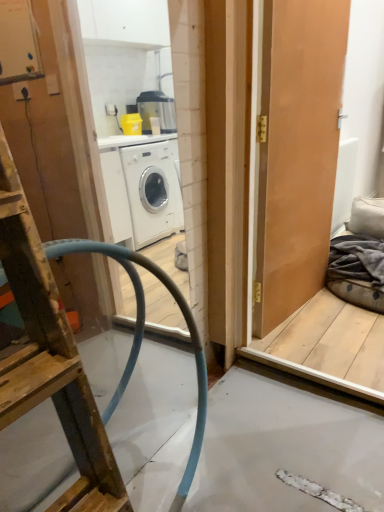
At what (x,y) coordinates should I click in order to perform the action: click on wooden ladder at left. Please return your answer as a coordinate pair (x, y). Image resolution: width=384 pixels, height=512 pixels. Looking at the image, I should click on (50, 357).

Which object is positioned more to the right, matte wooden door at right or dark grey fabric at right?

dark grey fabric at right is more to the right.

Are matte wooden door at right and dark grey fabric at right located far from each other?

No, matte wooden door at right is in close proximity to dark grey fabric at right.

In the scene shown: Does matte wooden door at right contain dark grey fabric at right?

Actually, dark grey fabric at right is outside matte wooden door at right.

How many degrees apart are the facing directions of matte wooden door at right and dark grey fabric at right?

They differ by 78.9 degrees in their facing directions.

Is point (91, 494) positioned after point (323, 39)?

No, (91, 494) is closer to viewer.

Is wooden ladder at left facing towards matte wooden door at right?

No, wooden ladder at left is not facing towards matte wooden door at right.

Considering the sizes of wooden ladder at left and matte wooden door at right in the image, is wooden ladder at left wider or thinner than matte wooden door at right?

Considering their sizes, wooden ladder at left looks broader than matte wooden door at right.

Is wooden ladder at left beside matte wooden door at right?

No, wooden ladder at left is not making contact with matte wooden door at right.

Find the location of a particular element. ladder positioned vertically above the dark grey fabric at right (from a real-world perspective) is located at coordinates (50, 357).

Who is shorter, dark grey fabric at right or wooden ladder at left?

dark grey fabric at right.

Considering the sizes of objects dark grey fabric at right and wooden ladder at left in the image provided, who is smaller, dark grey fabric at right or wooden ladder at left?

Smaller between the two is dark grey fabric at right.

Is dark grey fabric at right at the left side of wooden ladder at left?

Incorrect, dark grey fabric at right is not on the left side of wooden ladder at left.

Is matte wooden door at right wider or thinner than wooden ladder at left?

Clearly, matte wooden door at right has less width compared to wooden ladder at left.

Is point (263, 34) positioned in front of point (38, 319)?

No, it is not.

Is matte wooden door at right spatially inside wooden ladder at left, or outside of it?

matte wooden door at right is spatially situated outside wooden ladder at left.

Can you confirm if dark grey fabric at right is thinner than matte wooden door at right?

No.

Identify the location of door on the left side of dark grey fabric at right. (297, 152).

Is dark grey fabric at right taller than matte wooden door at right?

No, dark grey fabric at right is not taller than matte wooden door at right.

In the scene shown: Is dark grey fabric at right inside the boundaries of matte wooden door at right, or outside?

dark grey fabric at right exists outside the volume of matte wooden door at right.

How far apart are wooden ladder at left and dark grey fabric at right?

wooden ladder at left is 6.49 feet from dark grey fabric at right.

From the image's perspective, between wooden ladder at left and dark grey fabric at right, which one is located above?

dark grey fabric at right.

Is wooden ladder at left far away from dark grey fabric at right?

wooden ladder at left is far away from dark grey fabric at right.

Is dark grey fabric at right a part of wooden ladder at left?

No.

Identify the location of material located behind the matte wooden door at right. (357, 260).

Where is `door on the right of wooden ladder at left`? This screenshot has width=384, height=512. door on the right of wooden ladder at left is located at coordinates (297, 152).

Estimate the real-world distances between objects in this image. Which object is further from dark grey fabric at right, matte wooden door at right or wooden ladder at left?

wooden ladder at left is positioned further to the anchor dark grey fabric at right.

Based on their spatial positions, is wooden ladder at left or dark grey fabric at right further from matte wooden door at right?

Based on the image, wooden ladder at left appears to be further to matte wooden door at right.

Estimate the real-world distances between objects in this image. Which object is further from dark grey fabric at right, wooden ladder at left or matte wooden door at right?

wooden ladder at left is positioned further to the anchor dark grey fabric at right.

Looking at the image, which one is located further to matte wooden door at right, dark grey fabric at right or wooden ladder at left?

wooden ladder at left.

From the image, which object appears to be farther from wooden ladder at left, dark grey fabric at right or matte wooden door at right?

Among the two, dark grey fabric at right is located further to wooden ladder at left.

When comparing their distances from wooden ladder at left, does matte wooden door at right or dark grey fabric at right seem further?

dark grey fabric at right is further to wooden ladder at left.

Find the location of a particular element. The image size is (384, 512). door between wooden ladder at left and dark grey fabric at right in the front-back direction is located at coordinates (297, 152).